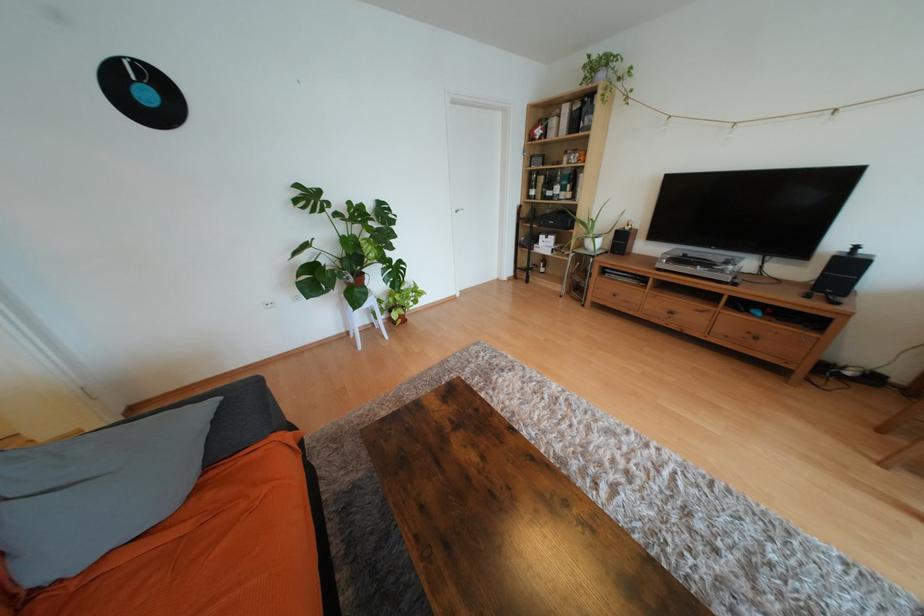
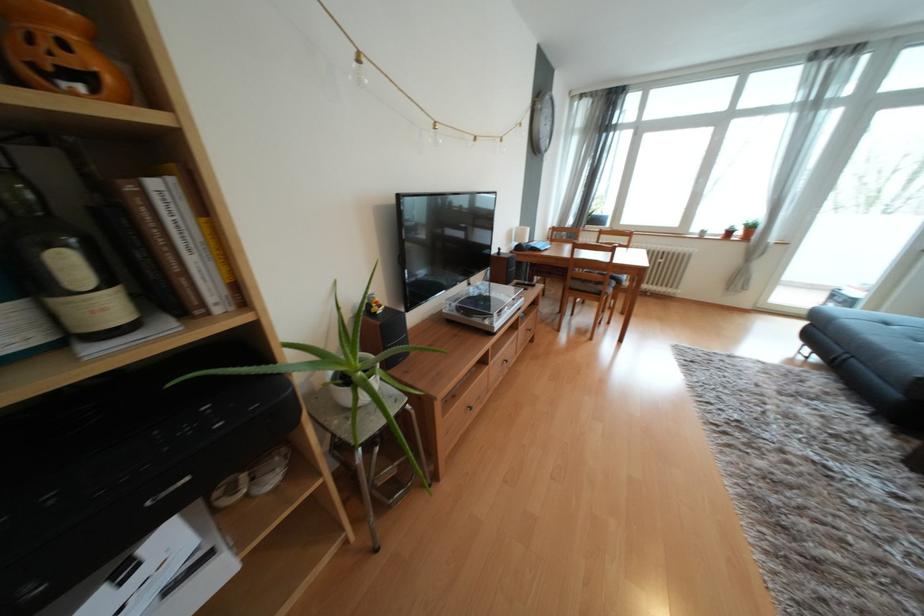
Where in the second image is the point corresponding to (x=633, y=230) from the first image?

(385, 312)